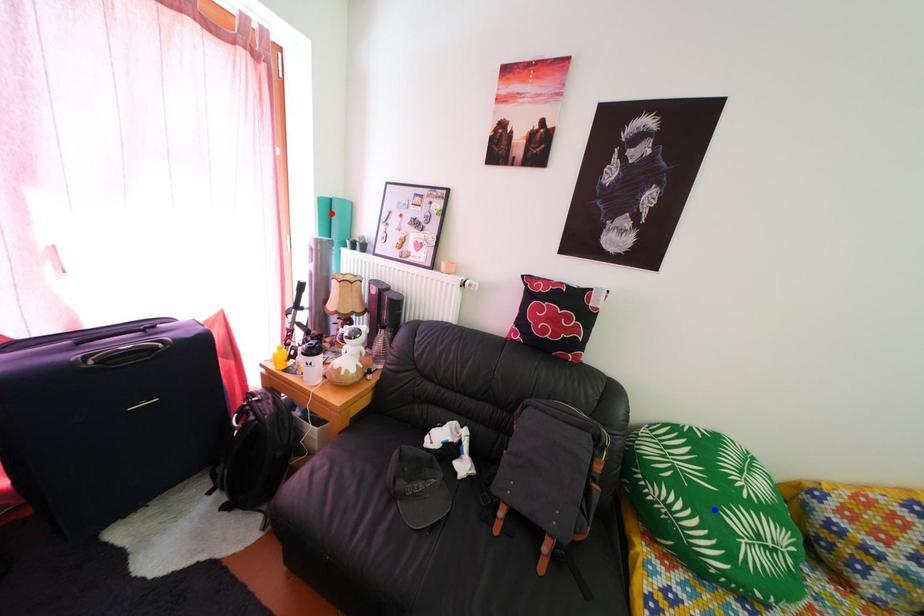
Question: Which of the two points in the image is closer to the camera?

Choices:
 (A) Blue point is closer.
 (B) Red point is closer.

Answer: (A)